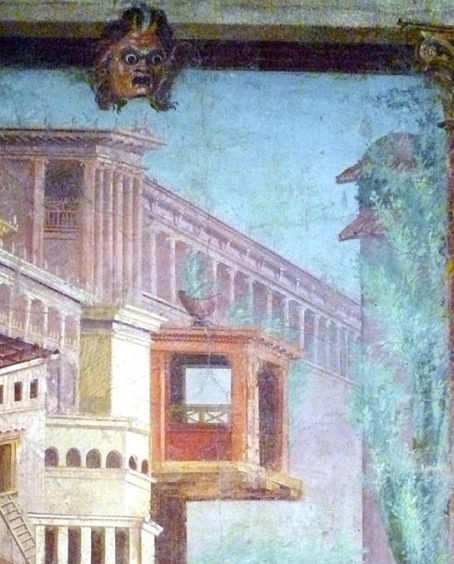
Locate an element on the screen. Image resolution: width=454 pixels, height=564 pixels. lilac colored wall is located at coordinates (325, 403), (370, 528).